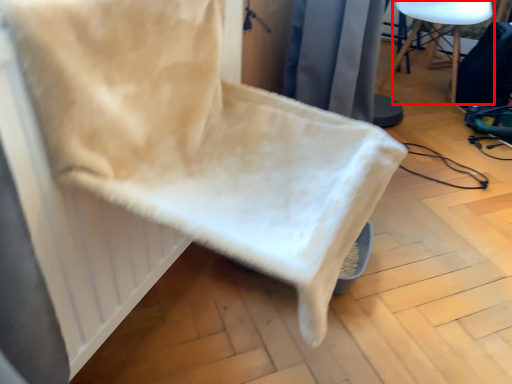
Question: From the image's perspective, where is furniture (annotated by the red box) located relative to chair?

Choices:
 (A) above
 (B) below

Answer: (A)